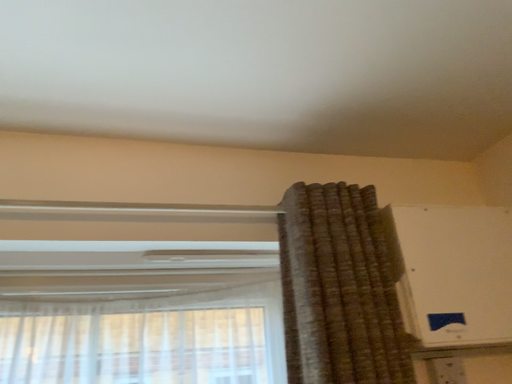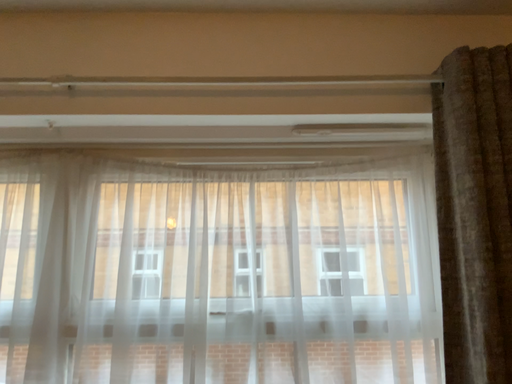
Question: Which way did the camera rotate in the video?

Choices:
 (A) rotated left
 (B) rotated right

Answer: (A)